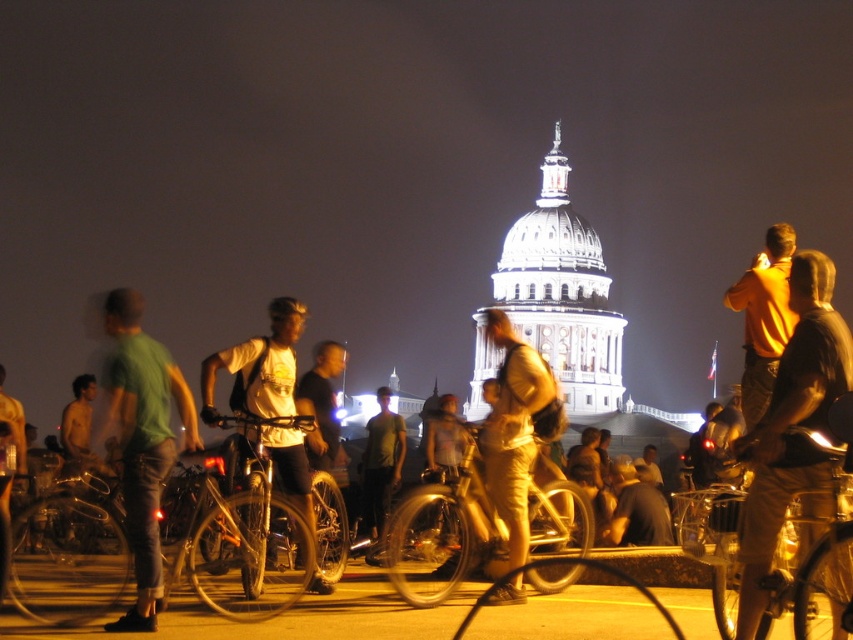
Which of these two, shiny metallic bicycle at center or light brown leather backpack at center, stands shorter?

With less height is shiny metallic bicycle at center.

Between shiny metallic bicycle at center and light brown leather backpack at center, which one is positioned lower?

shiny metallic bicycle at center is lower down.

Does point (445, 548) come behind point (334, 444)?

That is False.

Image resolution: width=853 pixels, height=640 pixels. I want to click on shiny metallic bicycle at center, so click(x=438, y=538).

Who is shorter, green cotton shirt at left or yellow matte shirt at upper right?

yellow matte shirt at upper right is shorter.

Does point (165, 456) come in front of point (775, 240)?

Yes, point (165, 456) is in front of point (775, 240).

The image size is (853, 640). Identify the location of green cotton shirt at left. (142, 440).

Who is positioned more to the right, yellow shirt at right or light yellow shirt at center?

Positioned to the right is yellow shirt at right.

Is yellow shirt at right taller than light yellow shirt at center?

Yes.

Which is in front, point (793, 424) or point (364, 486)?

Point (793, 424) is more forward.

You are a GUI agent. You are given a task and a screenshot of the screen. Output one action in this format:
    pyautogui.click(x=<x>, y=<y>)
    Task: Click on the yellow shirt at right
    This screenshot has width=853, height=640.
    Given the screenshot: What is the action you would take?
    pyautogui.click(x=791, y=428)